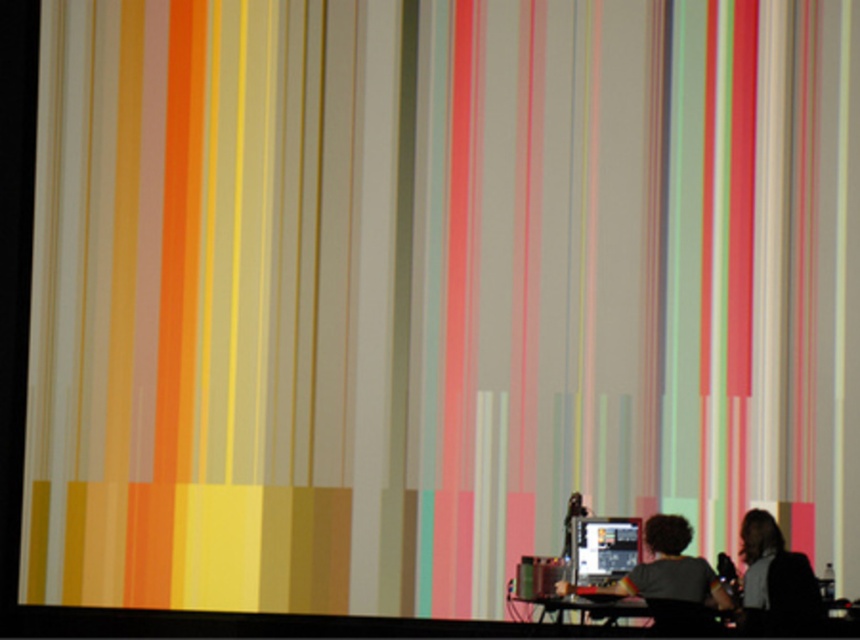
You are standing in front of the screen and want to place a small sticker exactly at the center of the matte black monitor at lower center. What are the coordinates where you should place it?

The coordinates for the center of the matte black monitor at lower center are at point (x=603, y=548).

You are a photographer trying to capture a clear shot of the dark brown hair at lower right and the matte black computer at lower center. Since you want to focus on the objects, which one should you adjust your camera lens to prioritize in terms of height?

The dark brown hair at lower right has a greater height compared to the matte black computer at lower center, so you should prioritize focusing on the dark brown hair at lower right to ensure both are in frame and properly captured.